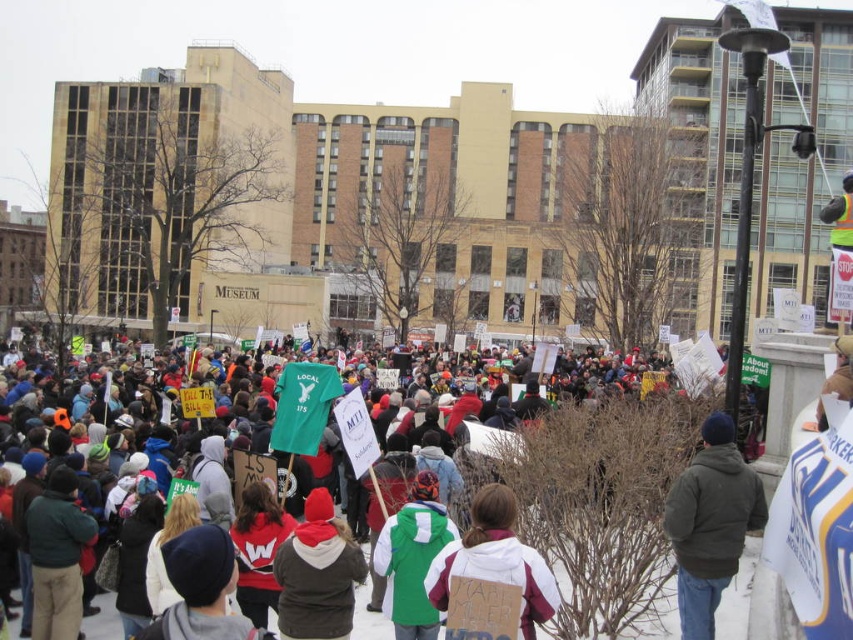
You are a photographer at the protest and want to capture a photo that includes both the red knit cap at center and the green fabric jacket at lower left. Based on their positions, which object should you focus on first to ensure both are in frame?

The red knit cap at center is above the green fabric jacket at lower left, so you should focus on the red knit cap at center first to ensure both are in frame.

Consider the image. You are a photographer standing at the center of the square, and you want to capture a photo of the dark green jacket at lower right. Which direction should you move to get a better shot?

The dark green jacket at lower right is located at point 0.817 on the x axis and 0.834 on the y axis, so you should move to the right and slightly forward to get a better shot.

You are a photographer standing at the camera position in the scene. You want to capture a closeup shot of the point at coordinate (309, 634). Given that your camera has a maximum focus range of 100 feet, will you be able to focus on that point?

The point at coordinate (309, 634) is 119.98 feet away from the camera, which exceeds the maximum focus range of 100 feet. Therefore, the camera cannot focus on that point.